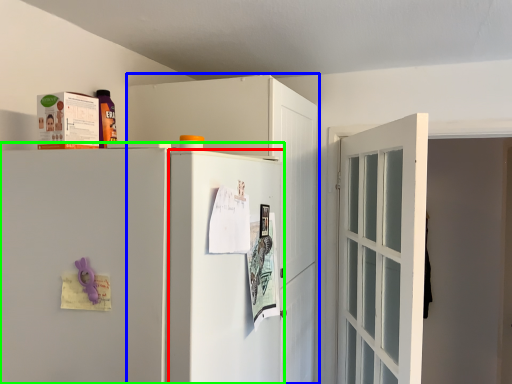
Question: Which is farther away from screen door (highlighted by a red box)? cabinetry (highlighted by a blue box) or refrigerator (highlighted by a green box)?

Choices:
 (A) cabinetry
 (B) refrigerator

Answer: (A)